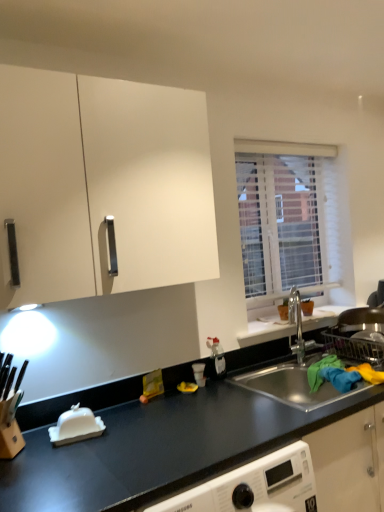
Where is `black matte countertop at center`? black matte countertop at center is located at coordinates (159, 448).

What is the approximate height of white textured blinds at upper right?

Result: It is 35.70 inches.

The width and height of the screenshot is (384, 512). What do you see at coordinates (293, 222) in the screenshot?
I see `white textured blinds at upper right` at bounding box center [293, 222].

Locate an element on the screen. white matte cabinet at upper left is located at coordinates (103, 185).

The height and width of the screenshot is (512, 384). Describe the element at coordinates (292, 387) in the screenshot. I see `stainless steel sink at lower right` at that location.

The height and width of the screenshot is (512, 384). In order to click on black matte countertop at center in this screenshot , I will do `click(159, 448)`.

Would you say white matte cabinet at upper left is inside or outside black matte countertop at center?

white matte cabinet at upper left is not inside black matte countertop at center, it's outside.

Between white matte cabinet at upper left and black matte countertop at center, which one has more height?

Standing taller between the two is white matte cabinet at upper left.

Can you confirm if white matte cabinet at upper left is bigger than black matte countertop at center?

No.

Can you confirm if white matte cabinet at upper left is thinner than black matte countertop at center?

Correct, the width of white matte cabinet at upper left is less than that of black matte countertop at center.

Who is smaller, white textured blinds at upper right or stainless steel sink at lower right?

white textured blinds at upper right is smaller.

Does white textured blinds at upper right come in front of stainless steel sink at lower right?

No.

In the image, there is a white textured blinds at upper right. Where is `sink below it (from the image's perspective)`? sink below it (from the image's perspective) is located at coordinates (292, 387).

Is white textured blinds at upper right far from stainless steel sink at lower right?

No, white textured blinds at upper right is not far away from stainless steel sink at lower right.

Is stainless steel sink at lower right taller than black matte countertop at center?

In fact, stainless steel sink at lower right may be shorter than black matte countertop at center.

Looking at this image, is stainless steel sink at lower right facing away from black matte countertop at center?

stainless steel sink at lower right does not have its back to black matte countertop at center.

Are stainless steel sink at lower right and black matte countertop at center located far from each other?

No, there isn't a large distance between stainless steel sink at lower right and black matte countertop at center.

Who is bigger, stainless steel sink at lower right or black matte countertop at center?

stainless steel sink at lower right is bigger.

Between black matte countertop at center and white matte cabinet at upper left, which one has larger width?

black matte countertop at center is wider.

Is black matte countertop at center in front of or behind white matte cabinet at upper left in the image?

black matte countertop at center is in front of white matte cabinet at upper left.

Considering the sizes of objects black matte countertop at center and white matte cabinet at upper left in the image provided, who is bigger, black matte countertop at center or white matte cabinet at upper left?

black matte countertop at center is bigger.

Is black matte countertop at center at the left side of white matte cabinet at upper left?

No.

From the image's perspective, between white matte cabinet at upper left and stainless steel sink at lower right, which one is located above?

white matte cabinet at upper left is shown above in the image.

Who is more distant, white matte cabinet at upper left or stainless steel sink at lower right?

stainless steel sink at lower right is further away from the camera.

Can you confirm if white matte cabinet at upper left is bigger than stainless steel sink at lower right?

Incorrect, white matte cabinet at upper left is not larger than stainless steel sink at lower right.

Looking at this image, considering the relative positions of white matte cabinet at upper left and stainless steel sink at lower right in the image provided, is white matte cabinet at upper left to the left of stainless steel sink at lower right from the viewer's perspective?

Correct, you'll find white matte cabinet at upper left to the left of stainless steel sink at lower right.

How many degrees apart are the facing directions of black matte countertop at center and stainless steel sink at lower right?

black matte countertop at center and stainless steel sink at lower right are facing 0.259 degrees away from each other.

Which object is positioned more to the left, black matte countertop at center or stainless steel sink at lower right?

black matte countertop at center.

From the image's perspective, is black matte countertop at center located above stainless steel sink at lower right?

Actually, black matte countertop at center appears below stainless steel sink at lower right in the image.

Is black matte countertop at center with stainless steel sink at lower right?

No, black matte countertop at center is not beside stainless steel sink at lower right.

Which point is more distant from viewer, (282, 392) or (98, 233)?

Positioned behind is point (282, 392).

Is white matte cabinet at upper left surrounded by stainless steel sink at lower right?

No.

Find the location of a particular element. This screenshot has width=384, height=512. cabinetry that is above the stainless steel sink at lower right (from the image's perspective) is located at coordinates (103, 185).

The width and height of the screenshot is (384, 512). Find the location of `countertop below the white matte cabinet at upper left (from a real-world perspective)`. countertop below the white matte cabinet at upper left (from a real-world perspective) is located at coordinates (159, 448).

This screenshot has height=512, width=384. I want to click on window behind the stainless steel sink at lower right, so click(x=293, y=222).

Looking at the image, which one is located closer to black matte countertop at center, stainless steel sink at lower right or white matte cabinet at upper left?

stainless steel sink at lower right.

In the scene shown: From the image, which object appears to be farther from white textured blinds at upper right, black matte countertop at center or stainless steel sink at lower right?

black matte countertop at center.

When comparing their distances from white textured blinds at upper right, does stainless steel sink at lower right or black matte countertop at center seem closer?

Among the two, stainless steel sink at lower right is located nearer to white textured blinds at upper right.

Looking at the image, which one is located closer to white matte cabinet at upper left, white textured blinds at upper right or black matte countertop at center?

black matte countertop at center lies closer to white matte cabinet at upper left than the other object.

Estimate the real-world distances between objects in this image. Which object is closer to stainless steel sink at lower right, white matte cabinet at upper left or black matte countertop at center?

Based on the image, black matte countertop at center appears to be nearer to stainless steel sink at lower right.

Looking at the image, which one is located closer to black matte countertop at center, stainless steel sink at lower right or white textured blinds at upper right?

Among the two, stainless steel sink at lower right is located nearer to black matte countertop at center.

When comparing their distances from white matte cabinet at upper left, does stainless steel sink at lower right or white textured blinds at upper right seem closer?

The object closer to white matte cabinet at upper left is white textured blinds at upper right.

Looking at the image, which one is located further to white matte cabinet at upper left, black matte countertop at center or stainless steel sink at lower right?

stainless steel sink at lower right lies further to white matte cabinet at upper left than the other object.

Find the location of a particular element. window between white matte cabinet at upper left and stainless steel sink at lower right from left to right is located at coordinates (293, 222).

What are the coordinates of `sink between black matte countertop at center and white textured blinds at upper right along the z-axis` in the screenshot? It's located at tap(292, 387).

Where is `window between white matte cabinet at upper left and black matte countertop at center in the vertical direction`? window between white matte cabinet at upper left and black matte countertop at center in the vertical direction is located at coordinates (293, 222).

Where is `sink that lies between white matte cabinet at upper left and black matte countertop at center from top to bottom`? This screenshot has height=512, width=384. sink that lies between white matte cabinet at upper left and black matte countertop at center from top to bottom is located at coordinates (292, 387).